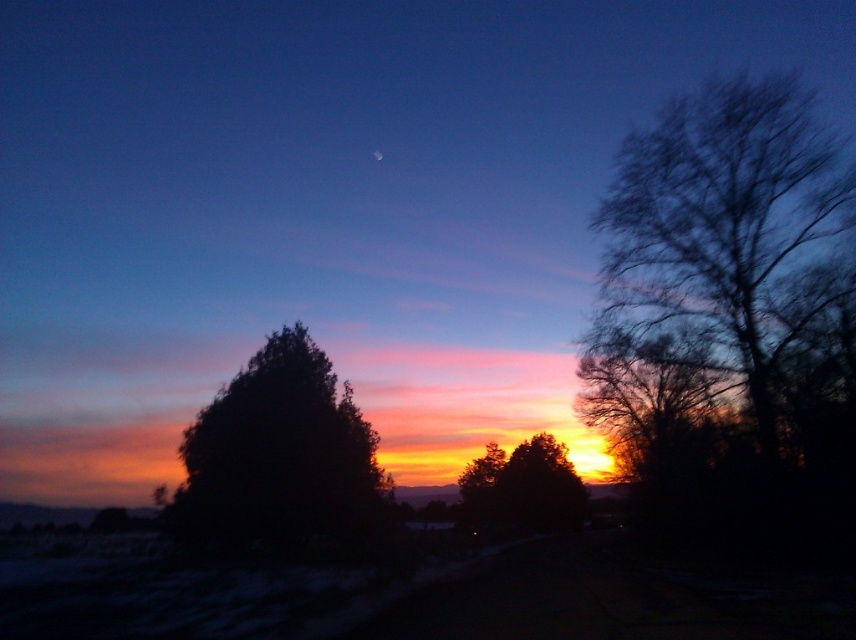
Which is more to the left, dark green leafy tree at center or silhouette tree at center?

dark green leafy tree at center

Which is behind, point (336, 496) or point (528, 449)?

Point (528, 449)

The width and height of the screenshot is (856, 640). Find the location of `dark green leafy tree at center`. dark green leafy tree at center is located at coordinates (278, 456).

Identify the location of dark green leafy tree at center. The height and width of the screenshot is (640, 856). (278, 456).

Can you confirm if bare branches at right is wider than silhouette tree at center?

No.

Can you confirm if bare branches at right is positioned to the right of silhouette tree at center?

Indeed, bare branches at right is positioned on the right side of silhouette tree at center.

Is point (800, 323) farther from viewer compared to point (528, 454)?

No, it is not.

Where is `bare branches at right`? This screenshot has height=640, width=856. bare branches at right is located at coordinates (712, 256).

Is bare branches at right behind dark green leafy tree at center?

No.

In the scene shown: Which is above, bare branches at right or dark green leafy tree at center?

Positioned higher is bare branches at right.

Does point (733, 344) come farther from viewer compared to point (227, 531)?

Yes, it is.

The width and height of the screenshot is (856, 640). What are the coordinates of `bare branches at right` in the screenshot? It's located at (712, 256).